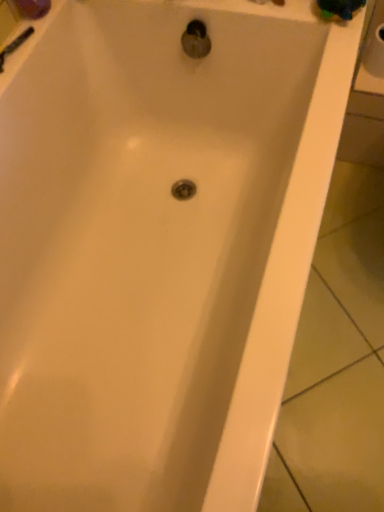
This screenshot has width=384, height=512. What do you see at coordinates (374, 52) in the screenshot?
I see `white paper towel at upper right` at bounding box center [374, 52].

This screenshot has width=384, height=512. In order to click on white paper towel at upper right in this screenshot , I will do `click(374, 52)`.

Identify the location of white paper towel at upper right. The height and width of the screenshot is (512, 384). (374, 52).